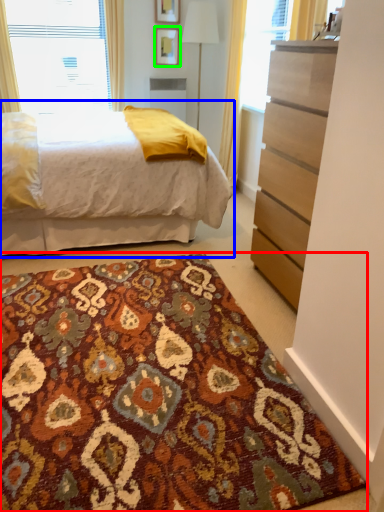
Question: Which is nearer to the doormat (highlighted by a red box)? bed (highlighted by a blue box) or picture frame (highlighted by a green box).

Choices:
 (A) bed
 (B) picture frame

Answer: (A)